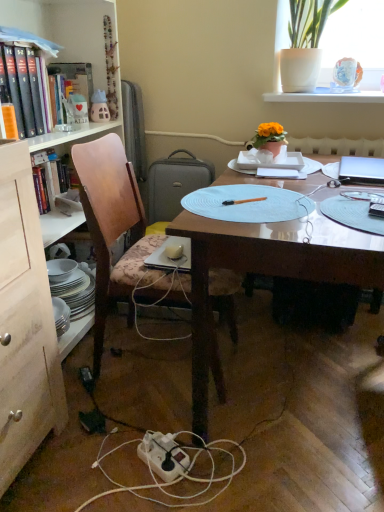
Where is `unoccupied space behind clear plastic pen at center`? Image resolution: width=384 pixels, height=512 pixels. unoccupied space behind clear plastic pen at center is located at coordinates (350, 188).